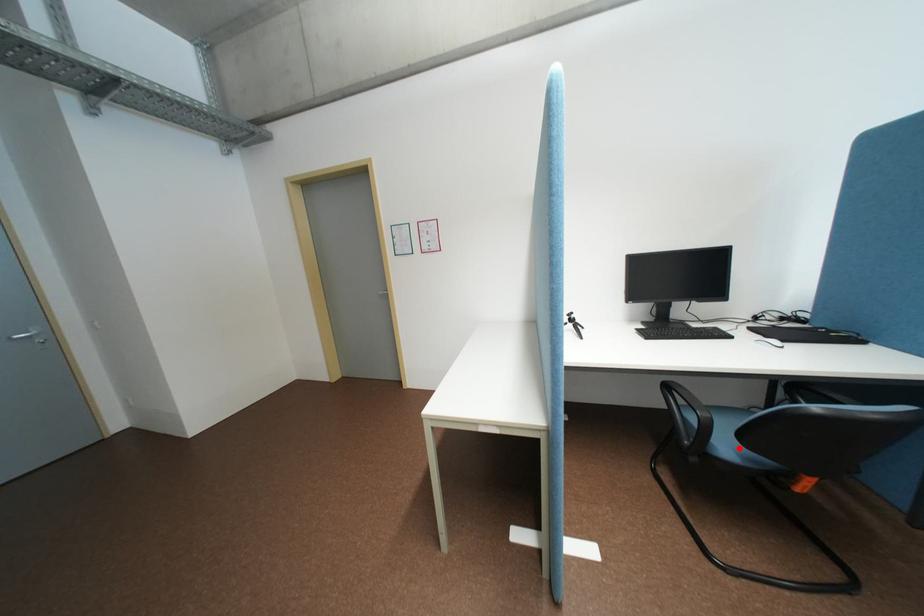
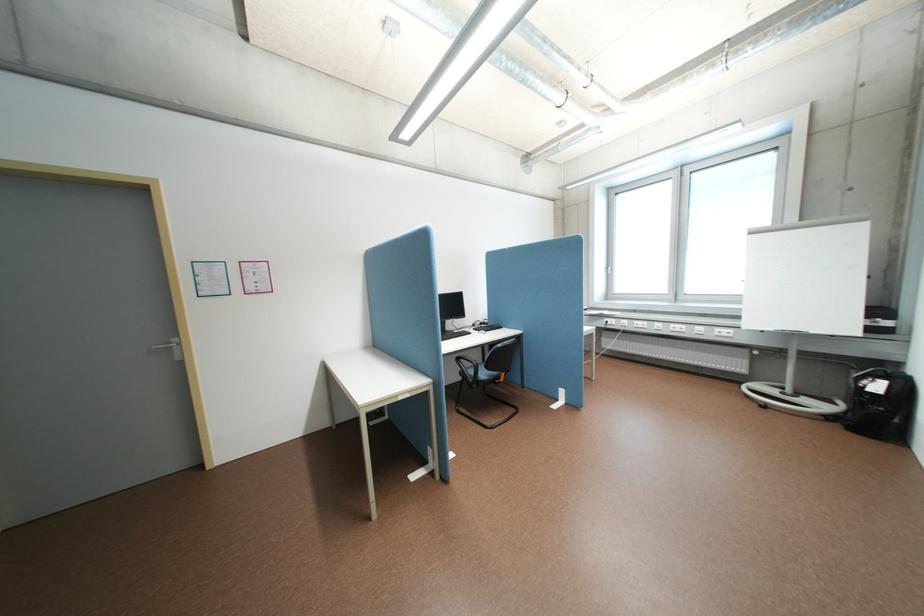
Find the pixel in the second image that matches the highlighted location in the first image.

(494, 374)